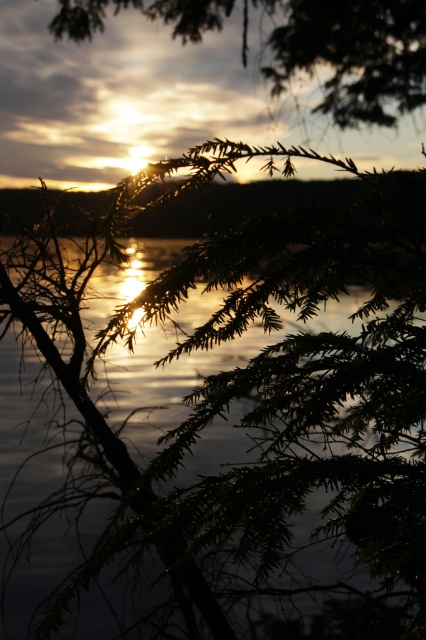
Question: Does glistening reflective water at center have a greater width compared to silvery metallic branches at upper center?

Choices:
 (A) yes
 (B) no

Answer: (B)

Question: Among these points, which one is farthest from the camera?

Choices:
 (A) (63, 28)
 (B) (368, 593)

Answer: (A)

Question: Which of the following is the farthest from the observer?

Choices:
 (A) silvery metallic branches at upper center
 (B) glistening reflective water at center

Answer: (A)

Question: From the image, what is the correct spatial relationship of glistening reflective water at center in relation to silvery metallic branches at upper center?

Choices:
 (A) left
 (B) right

Answer: (A)

Question: Where is glistening reflective water at center located in relation to silvery metallic branches at upper center in the image?

Choices:
 (A) right
 (B) left

Answer: (B)

Question: Which object is closer to the camera taking this photo?

Choices:
 (A) glistening reflective water at center
 (B) silvery metallic branches at upper center

Answer: (A)